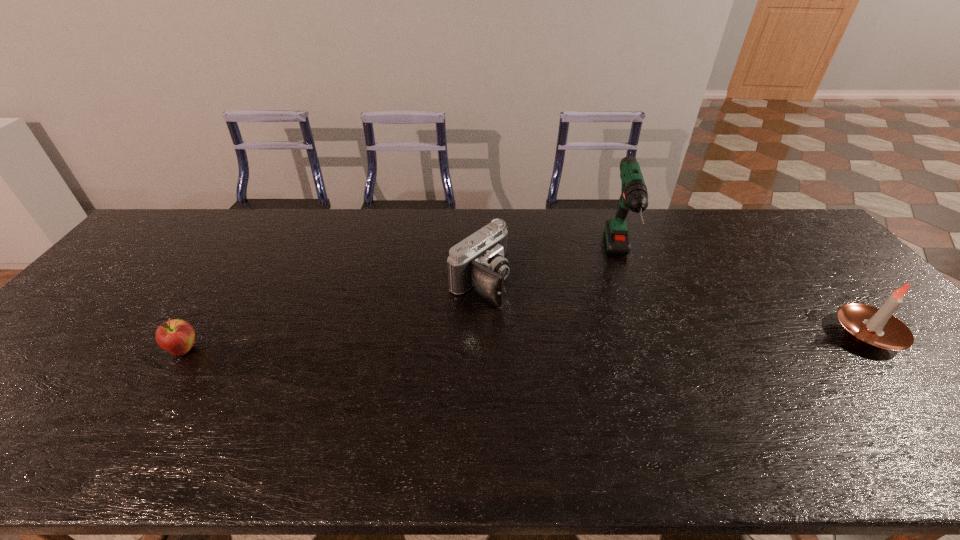
At what (x,y) coordinates should I click in order to perform the action: click on the leftmost object. Please return your answer as a coordinate pair (x, y). This screenshot has width=960, height=540. Looking at the image, I should click on (176, 336).

At what (x,y) coordinates should I click in order to perform the action: click on the shortest object. Please return your answer as a coordinate pair (x, y). Looking at the image, I should click on (176, 336).

Where is `the rightmost object`? Image resolution: width=960 pixels, height=540 pixels. the rightmost object is located at coordinates pyautogui.click(x=876, y=328).

This screenshot has width=960, height=540. I want to click on camera, so click(x=479, y=262).

Where is `the second shortest object`? The height and width of the screenshot is (540, 960). the second shortest object is located at coordinates [479, 262].

I want to click on drill, so 634,196.

The image size is (960, 540). I want to click on the third object from left to right, so [634, 196].

Where is `vacant space located on the right of the apple`? vacant space located on the right of the apple is located at coordinates (356, 350).

What are the coordinates of `vacant space located 0.250m on the left of the rightmost object` in the screenshot? It's located at (740, 334).

This screenshot has height=540, width=960. In order to click on vacant space located at the front of the camera with an open lens cover in this screenshot , I will do `click(545, 326)`.